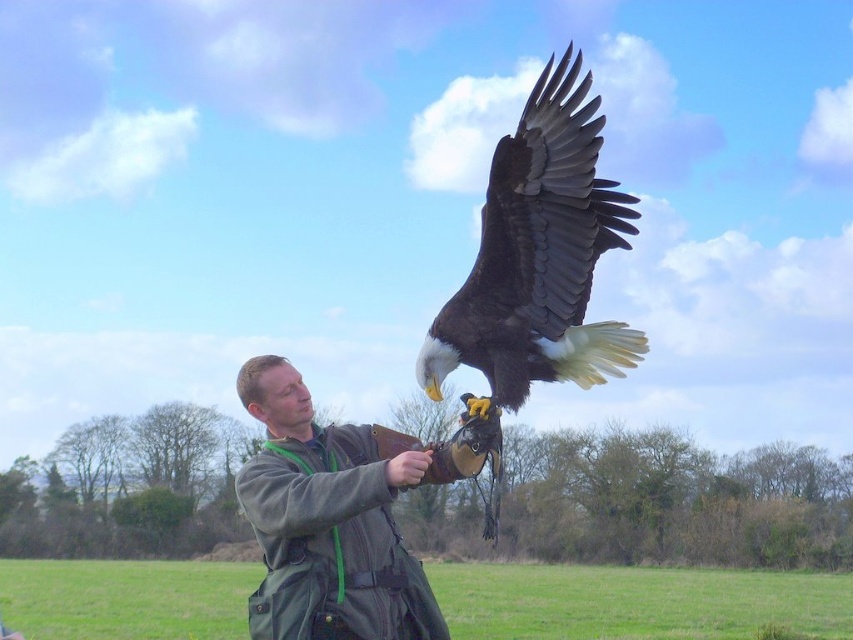
You are a drone operator trying to capture a photo of the green fabric jacket at center. You are currently positioned at point (323,524). Is the green fabric jacket at center directly below you?

The point (323,524) is where the green fabric jacket at center is located, so yes, the green fabric jacket at center is directly below you at that point.

You are a drone operator tasked with capturing aerial footage of the scene. The green fabric bag at center is located at coordinates point 0.941, 0.747. To ensure the bag is in frame, which direction should you adjust the drone camera relative to the man holding the bird of prey?

The green fabric bag at center is located at point (x=636, y=602), so the drone camera should be adjusted to face towards the center area where the man is standing to keep the bag in frame.